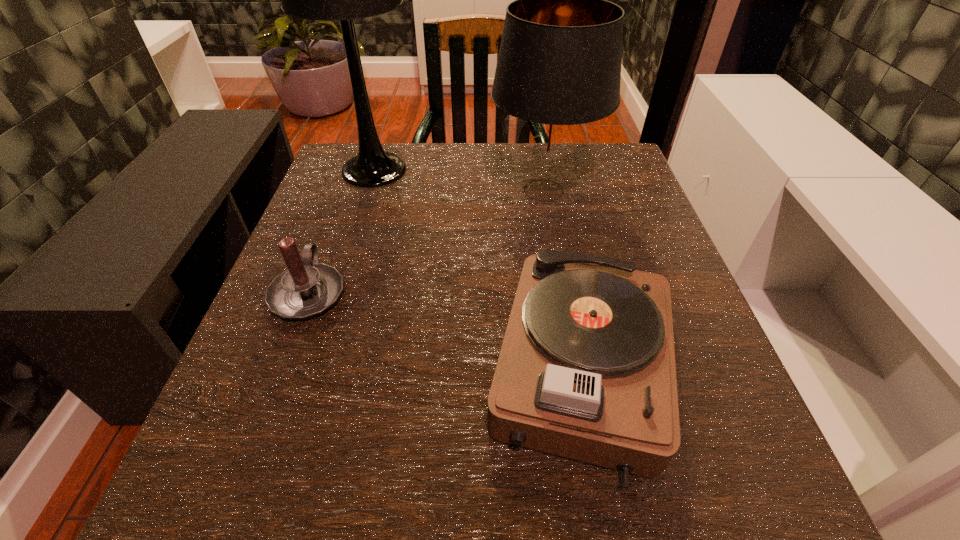
You are a GUI agent. You are given a task and a screenshot of the screen. Output one action in this format:
    pyautogui.click(x=<x>, y=<y>)
    Task: Click on the table lamp at the far edge
    The height and width of the screenshot is (540, 960).
    Given the screenshot: What is the action you would take?
    pyautogui.click(x=326, y=0)

At what (x,y) coordinates should I click in order to perform the action: click on lampshade positioned at the far edge. Please return your answer as a coordinate pair (x, y). Image resolution: width=960 pixels, height=540 pixels. Looking at the image, I should click on (558, 72).

You are a GUI agent. You are given a task and a screenshot of the screen. Output one action in this format:
    pyautogui.click(x=<x>, y=<y>)
    Task: Click on the object located in the near edge section of the desktop
    
    Given the screenshot: What is the action you would take?
    pyautogui.click(x=586, y=371)

The image size is (960, 540). Find the location of `table lamp situated at the left edge`. table lamp situated at the left edge is located at coordinates (326, 0).

Identify the location of candle located in the left edge section of the desktop. (307, 288).

Where is `lampshade located in the right edge section of the desktop`? The width and height of the screenshot is (960, 540). lampshade located in the right edge section of the desktop is located at coordinates (558, 72).

The height and width of the screenshot is (540, 960). What are the coordinates of `record player that is at the right edge` in the screenshot? It's located at (586, 371).

I want to click on object present at the far left corner, so click(x=326, y=0).

Where is `object that is positioned at the far right corner`? This screenshot has width=960, height=540. object that is positioned at the far right corner is located at coordinates (558, 72).

Identify the location of object at the near right corner. (586, 371).